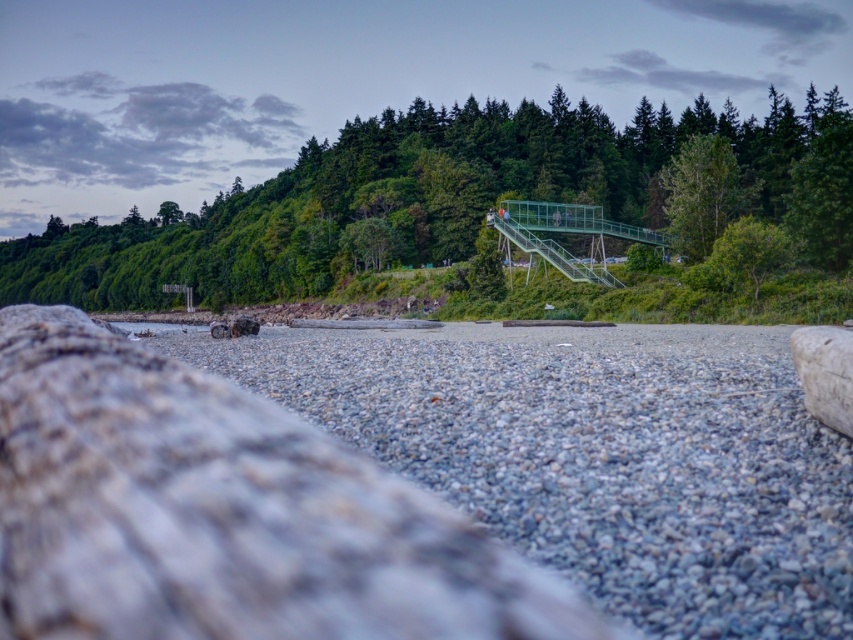
Question: Does green metallic bridge at upper center have a lesser width compared to green leafy tree at upper center?

Choices:
 (A) yes
 (B) no

Answer: (B)

Question: Based on their relative distances, which object is farther from the gray rough wood at center?

Choices:
 (A) green metallic bridge at upper center
 (B) green leafy tree at upper center

Answer: (A)

Question: Considering the relative positions of green metallic bridge at upper center and green leafy tree at upper center in the image provided, where is green metallic bridge at upper center located with respect to green leafy tree at upper center?

Choices:
 (A) above
 (B) below

Answer: (A)

Question: Which object is positioned closest to the gray rough wood at center?

Choices:
 (A) green leafy tree at upper center
 (B) green metallic bridge at upper center

Answer: (A)

Question: Among these objects, which one is farthest from the camera?

Choices:
 (A) gray rough wood at center
 (B) green metallic bridge at upper center

Answer: (B)

Question: Does gray rough wood at center appear under green leafy tree at upper center?

Choices:
 (A) no
 (B) yes

Answer: (B)